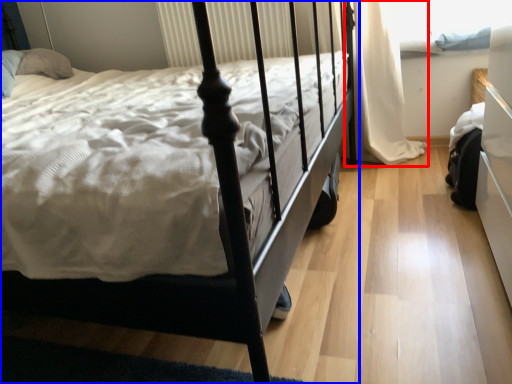
Question: Which point is further to the camera, curtain (highlighted by a red box) or bed (highlighted by a blue box)?

Choices:
 (A) curtain
 (B) bed

Answer: (A)